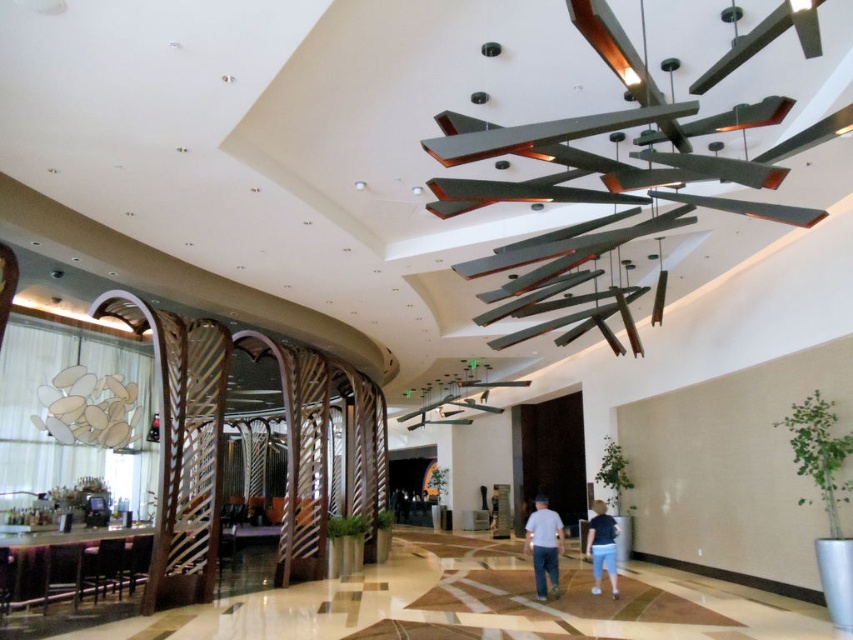
Who is lower down, light blue shirt at center or blue denim shorts at center?

blue denim shorts at center

Who is more distant from viewer, (538,529) or (612,524)?

The point (612,524) is behind.

Is point (556, 580) closer to viewer compared to point (589, 540)?

Yes, it is.

At what (x,y) coordinates should I click in order to perform the action: click on light blue shirt at center. Please return your answer as a coordinate pair (x, y). This screenshot has height=640, width=853. Looking at the image, I should click on click(544, 545).